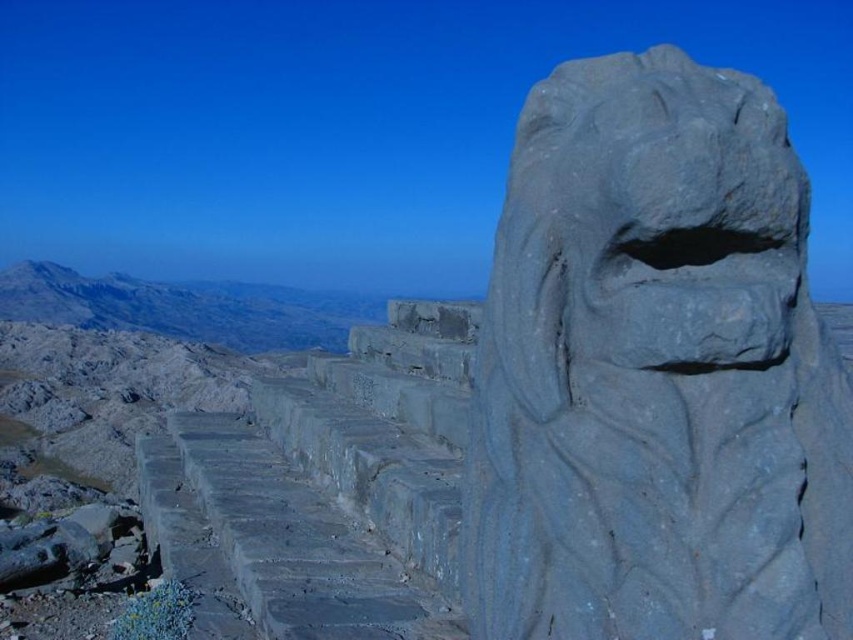
You are standing at the base of the ancient stone structure and notice the gray stone lion at right. If you want to reach the lion, should you move towards the right or left side of the staircase?

Since the gray stone lion at right is located at point 0.584 on the x and 0.769 on the y coordinate, you should move towards the right side of the staircase to reach it.

You are a hiker standing at the base of the rugged stone mountain at upper left and want to reach the gray stone lion at right. Which object is closer to your starting position?

The rugged stone mountain at upper left is closer to your starting position because you are already at its base, while the gray stone lion at right is further away.

You are an adventurer standing at the base of the ancient stone structure. You see the gray stone lion at right and the rugged stone mountain at upper left. Which object is positioned higher in the scene?

The rugged stone mountain at upper left is positioned higher than the gray stone lion at right because the gray stone lion at right is located below it.